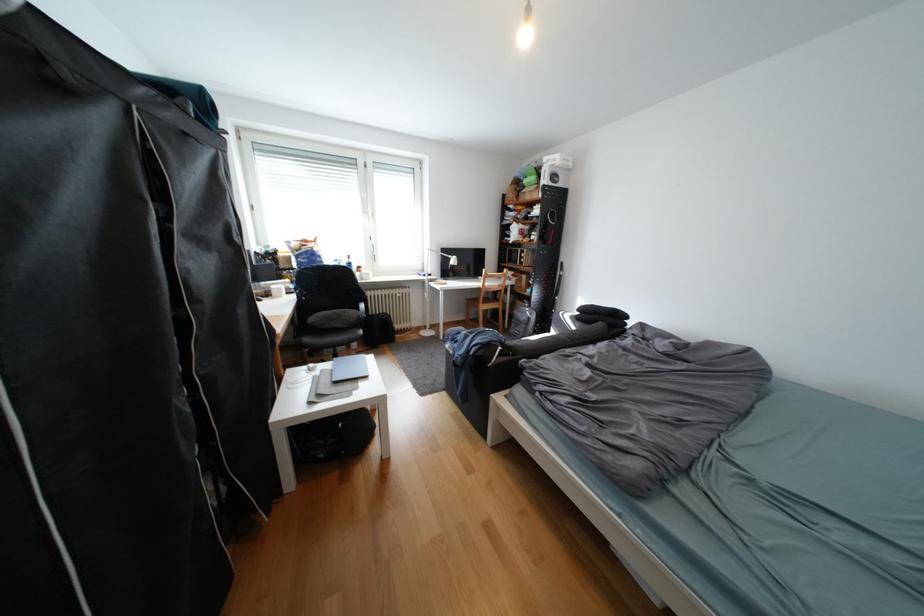
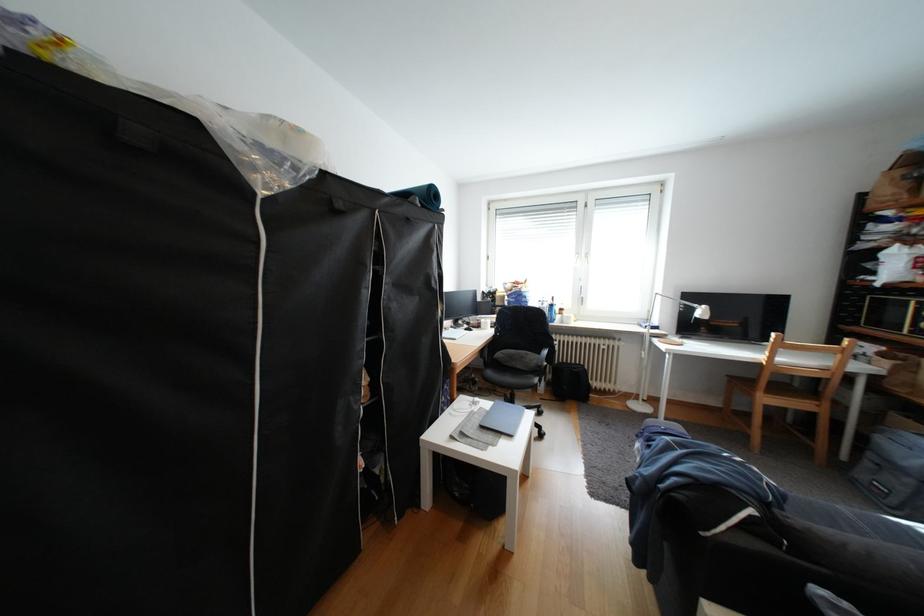
The point at (444, 285) is marked in the first image. Where is the corresponding point in the second image?

(667, 341)